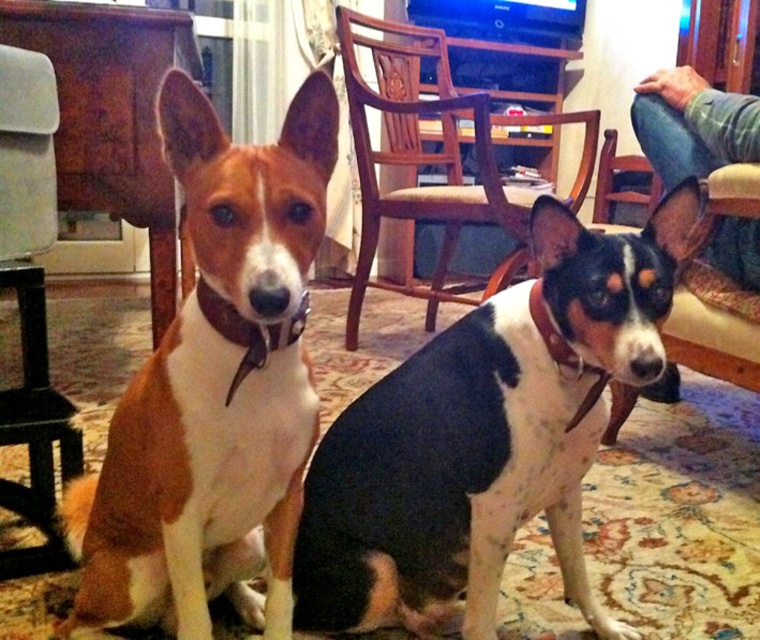
Question: Does wooden chair at center have a larger size compared to velvet-like beige armchair at left?

Choices:
 (A) yes
 (B) no

Answer: (A)

Question: Can you confirm if black and white fur at center is positioned to the right of velvet-like beige armchair at left?

Choices:
 (A) no
 (B) yes

Answer: (B)

Question: Can you confirm if wooden chair at center is positioned below velvet-like beige armchair at left?

Choices:
 (A) yes
 (B) no

Answer: (B)

Question: Considering the real-world distances, which object is closest to the brown leather collar at center?

Choices:
 (A) jeans at lower right
 (B) velvet-like beige armchair at left

Answer: (A)

Question: Estimate the real-world distances between objects in this image. Which object is closer to the brown and white fur at center?

Choices:
 (A) black and white fur at center
 (B) jeans at lower right
 (C) wooden chair at center
 (D) velvet-like beige armchair at left

Answer: (A)

Question: Based on their relative distances, which object is farther from the velvet-like beige armchair at left?

Choices:
 (A) black and white fur at center
 (B) wooden chair at center
 (C) brown and white fur at center
 (D) jeans at lower right

Answer: (B)